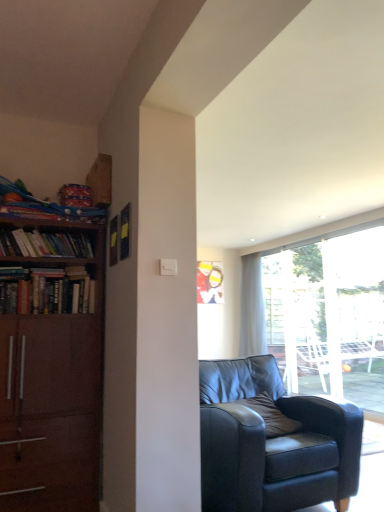
Question: From the image's perspective, is hardcover books at left, which is the second book in bottom-to-top order, on top of matte black armchair at center?

Choices:
 (A) yes
 (B) no

Answer: (A)

Question: Is hardcover books at left, which is the second book in bottom-to-top order, positioned far away from matte black armchair at center?

Choices:
 (A) yes
 (B) no

Answer: (A)

Question: Does hardcover books at left, which is the second book in bottom-to-top order, appear on the left side of matte black armchair at center?

Choices:
 (A) no
 (B) yes

Answer: (B)

Question: Would you say hardcover books at left, which is the second book in bottom-to-top order, contains matte black armchair at center?

Choices:
 (A) yes
 (B) no

Answer: (B)

Question: Is hardcover books at left, which is the second book in bottom-to-top order, directly adjacent to matte black armchair at center?

Choices:
 (A) yes
 (B) no

Answer: (B)

Question: Would you say white sheer curtain at center is inside or outside brown leather pillow at center?

Choices:
 (A) inside
 (B) outside

Answer: (B)

Question: From a real-world perspective, relative to brown leather pillow at center, is white sheer curtain at center vertically above or below?

Choices:
 (A) above
 (B) below

Answer: (A)

Question: Considering their positions, is white sheer curtain at center located in front of or behind brown leather pillow at center?

Choices:
 (A) behind
 (B) front

Answer: (A)

Question: From the image's perspective, is white sheer curtain at center positioned above or below brown leather pillow at center?

Choices:
 (A) below
 (B) above

Answer: (B)

Question: Considering the positions of wooden bookshelf at left, which is the 1th book in bottom-to-top order, and white sheer curtain at center in the image, is wooden bookshelf at left, which is the 1th book in bottom-to-top order, taller or shorter than white sheer curtain at center?

Choices:
 (A) tall
 (B) short

Answer: (B)

Question: From the image's perspective, relative to white sheer curtain at center, is wooden bookshelf at left, positioned as the 2th book in top-to-bottom order, above or below?

Choices:
 (A) below
 (B) above

Answer: (B)

Question: Looking at their shapes, would you say wooden bookshelf at left, positioned as the 2th book in top-to-bottom order, is wider or thinner than white sheer curtain at center?

Choices:
 (A) wide
 (B) thin

Answer: (A)

Question: Is point (48, 303) positioned closer to the camera than point (246, 259)?

Choices:
 (A) farther
 (B) closer

Answer: (B)

Question: In terms of width, does matte black armchair at center look wider or thinner when compared to brown leather pillow at center?

Choices:
 (A) wide
 (B) thin

Answer: (A)

Question: Is matte black armchair at center in front of or behind brown leather pillow at center in the image?

Choices:
 (A) behind
 (B) front

Answer: (B)